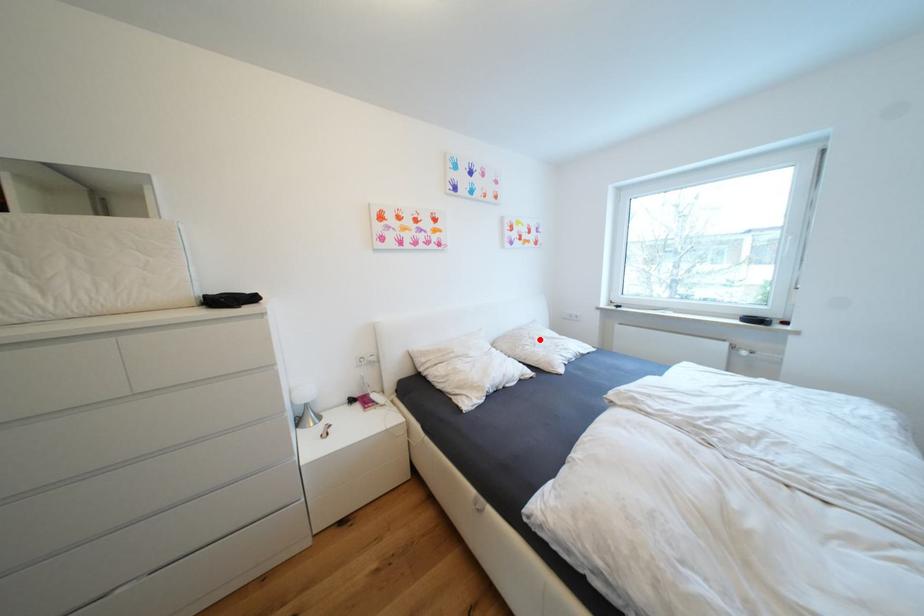
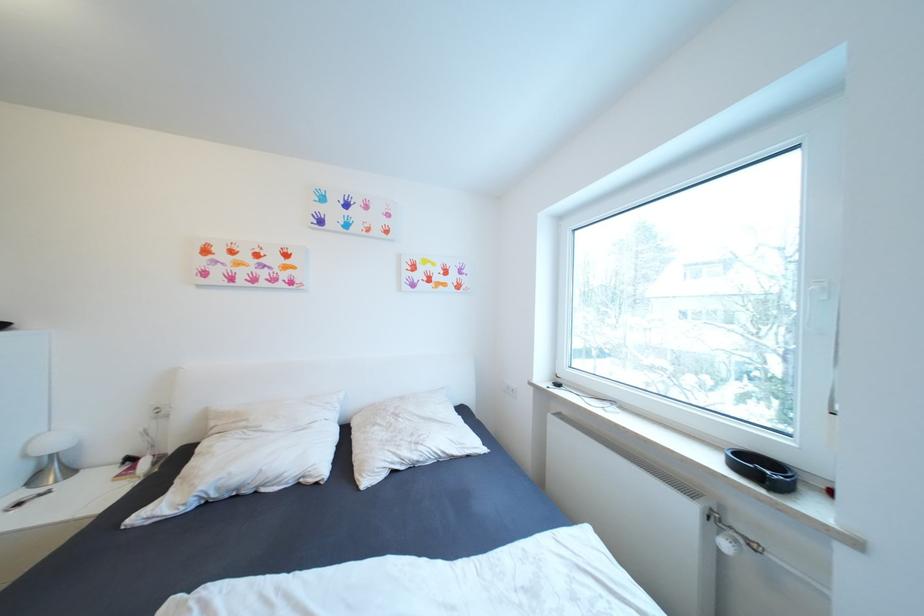
Find the pixel in the second image that matches the highlighted location in the first image.

(405, 416)